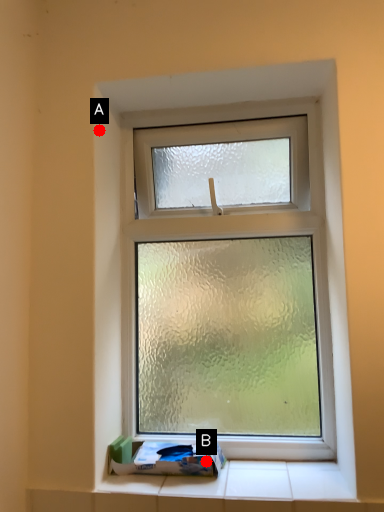
Question: Two points are circled on the image, labeled by A and B beside each circle. Which point is closer to the camera?

Choices:
 (A) A is closer
 (B) B is closer

Answer: (B)